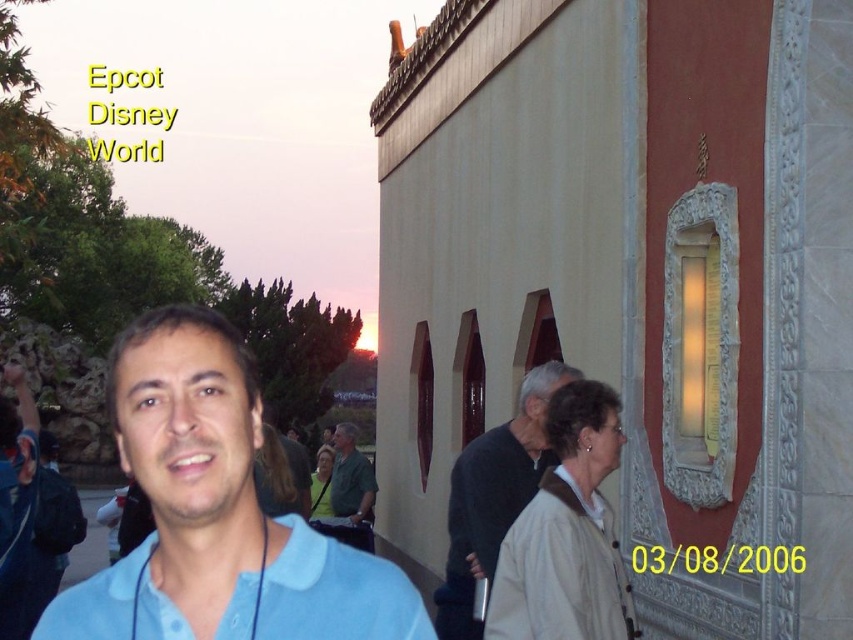
Which of these two, light blue cotton shirt at center or light blue cotton polo shirt at center, stands shorter?

light blue cotton polo shirt at center is shorter.

Between light blue cotton shirt at center and light blue cotton polo shirt at center, which one appears on the right side from the viewer's perspective?

Positioned to the right is light blue cotton polo shirt at center.

Between point (328, 589) and point (148, 637), which one is positioned in front?

Point (148, 637) is in front.

At what (x,y) coordinates should I click in order to perform the action: click on light blue cotton shirt at center. Please return your answer as a coordinate pair (x, y). This screenshot has width=853, height=640. Looking at the image, I should click on (218, 513).

Who is shorter, light blue cotton shirt at center or beige cotton polo shirt at center?

Standing shorter between the two is beige cotton polo shirt at center.

Is light blue cotton shirt at center to the right of beige cotton polo shirt at center from the viewer's perspective?

Incorrect, light blue cotton shirt at center is not on the right side of beige cotton polo shirt at center.

Does point (154, 564) come closer to viewer compared to point (549, 637)?

Yes, it is.

What are the coordinates of `light blue cotton shirt at center` in the screenshot? It's located at (218, 513).

Can you confirm if light blue cotton shirt at center is positioned above green fabric shirt at center?

Correct, light blue cotton shirt at center is located above green fabric shirt at center.

Between light blue cotton shirt at center and green fabric shirt at center, which one is positioned higher?

Positioned higher is light blue cotton shirt at center.

The width and height of the screenshot is (853, 640). Identify the location of light blue cotton shirt at center. (218, 513).